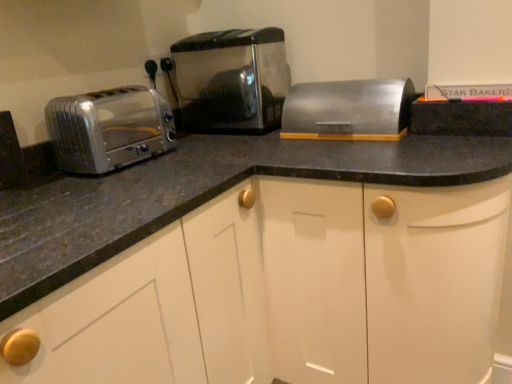
Question: From the image's perspective, is satin metallic toaster at center, acting as the 1th toaster starting from the right, above satin silver toaster at left, positioned as the second toaster in right-to-left order?

Choices:
 (A) no
 (B) yes

Answer: (B)

Question: Can you confirm if satin metallic toaster at center, acting as the 1th toaster starting from the right, is taller than satin silver toaster at left, arranged as the 1th toaster when viewed from the left?

Choices:
 (A) no
 (B) yes

Answer: (B)

Question: Is satin metallic toaster at center, the second toaster viewed from the left, positioned with its back to satin silver toaster at left, arranged as the 1th toaster when viewed from the left?

Choices:
 (A) no
 (B) yes

Answer: (A)

Question: From a real-world perspective, is satin metallic toaster at center, the second toaster viewed from the left, over satin silver toaster at left, positioned as the second toaster in right-to-left order?

Choices:
 (A) yes
 (B) no

Answer: (A)

Question: Is satin metallic toaster at center, the second toaster viewed from the left, not near satin silver toaster at left, positioned as the second toaster in right-to-left order?

Choices:
 (A) yes
 (B) no

Answer: (B)

Question: Can you confirm if satin metallic toaster at center, the second toaster viewed from the left, is smaller than satin silver toaster at left, arranged as the 1th toaster when viewed from the left?

Choices:
 (A) no
 (B) yes

Answer: (A)

Question: Is satin metallic toaster at center, acting as the 1th toaster starting from the right, behind satin silver breadbox at center?

Choices:
 (A) no
 (B) yes

Answer: (B)

Question: Is satin metallic toaster at center, the second toaster viewed from the left, completely or partially outside of satin silver breadbox at center?

Choices:
 (A) yes
 (B) no

Answer: (A)

Question: Does satin metallic toaster at center, the second toaster viewed from the left, have a lesser height compared to satin silver breadbox at center?

Choices:
 (A) yes
 (B) no

Answer: (B)

Question: From a real-world perspective, is satin metallic toaster at center, the second toaster viewed from the left, positioned over satin silver breadbox at center based on gravity?

Choices:
 (A) no
 (B) yes

Answer: (B)

Question: Is satin silver breadbox at center inside satin metallic toaster at center, acting as the 1th toaster starting from the right?

Choices:
 (A) no
 (B) yes

Answer: (A)

Question: Does satin metallic toaster at center, the second toaster viewed from the left, turn towards satin silver breadbox at center?

Choices:
 (A) no
 (B) yes

Answer: (A)

Question: Does satin silver toaster at left, arranged as the 1th toaster when viewed from the left, contain satin silver breadbox at center?

Choices:
 (A) no
 (B) yes

Answer: (A)